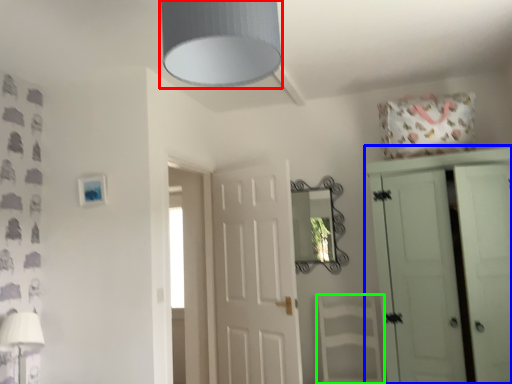
Question: Which is nearer to the light fixture (highlighted by a red box)? cupboard (highlighted by a blue box) or armchair (highlighted by a green box).

Choices:
 (A) cupboard
 (B) armchair

Answer: (A)